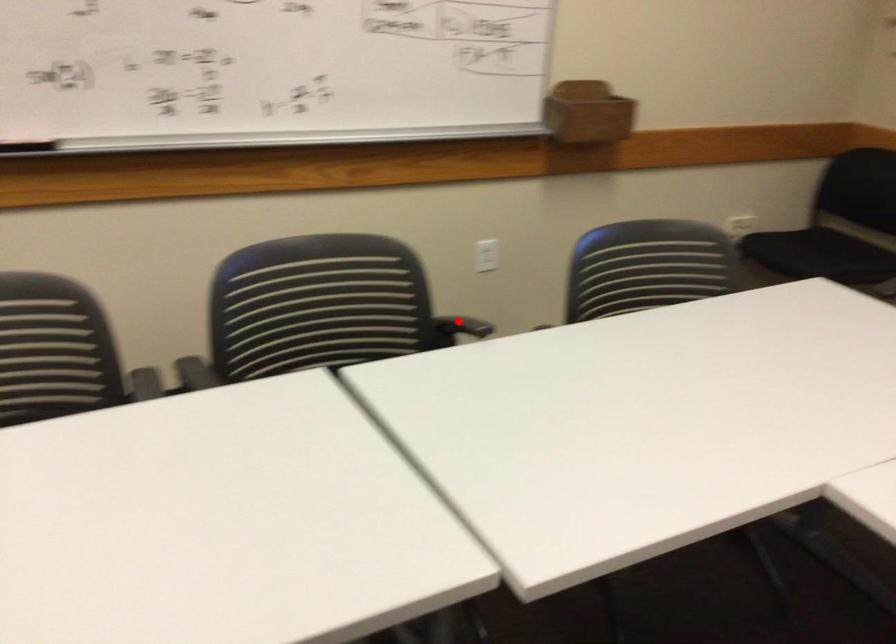
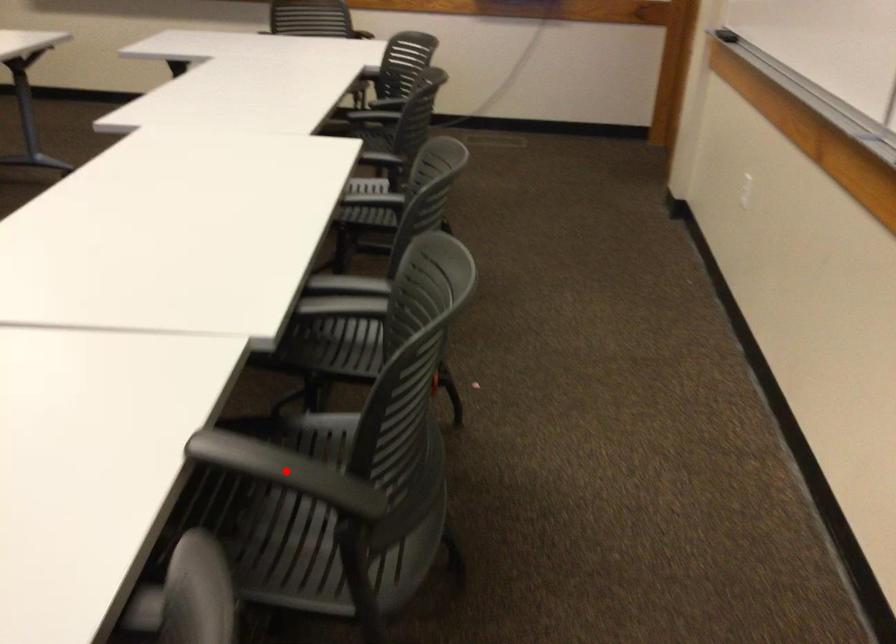
I am providing you with two images of the same scene from different viewpoints. A red point is marked on the first image and another point is marked on the second image. Are the points marked in image1 and image2 representing the same 3D position?

Yes